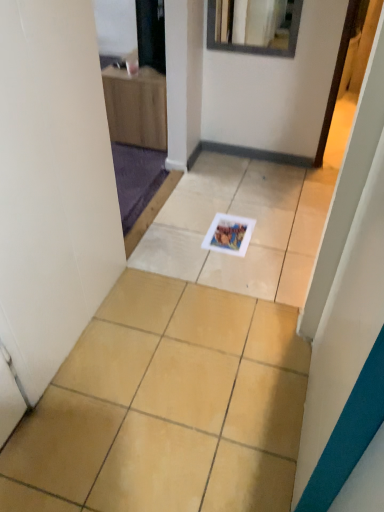
Question: Which is correct: beige ceramic tile at center is inside white glossy magazine at center, or outside of it?

Choices:
 (A) inside
 (B) outside

Answer: (B)

Question: Considering the positions of point (258, 431) and point (221, 237), is point (258, 431) closer or farther from the camera than point (221, 237)?

Choices:
 (A) farther
 (B) closer

Answer: (B)

Question: From a real-world perspective, is beige ceramic tile at center physically located above or below white glossy magazine at center?

Choices:
 (A) above
 (B) below

Answer: (B)

Question: Is white glossy magazine at center in front of or behind beige ceramic tile at center in the image?

Choices:
 (A) front
 (B) behind

Answer: (B)

Question: Considering the positions of white glossy magazine at center and beige ceramic tile at center in the image, is white glossy magazine at center wider or thinner than beige ceramic tile at center?

Choices:
 (A) thin
 (B) wide

Answer: (A)

Question: Considering the positions of white glossy magazine at center and beige ceramic tile at center in the image, is white glossy magazine at center bigger or smaller than beige ceramic tile at center?

Choices:
 (A) small
 (B) big

Answer: (A)

Question: From a real-world perspective, is white glossy magazine at center positioned above or below beige ceramic tile at center?

Choices:
 (A) below
 (B) above

Answer: (B)